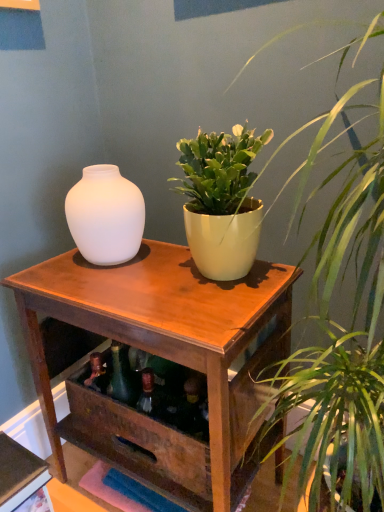
Image resolution: width=384 pixels, height=512 pixels. Find the location of `vacant space in green matte plant pot at center, marked as the 1th houseplant in a top-to-bottom arrangement (from a real-world perspective)`. vacant space in green matte plant pot at center, marked as the 1th houseplant in a top-to-bottom arrangement (from a real-world perspective) is located at coordinates (205, 278).